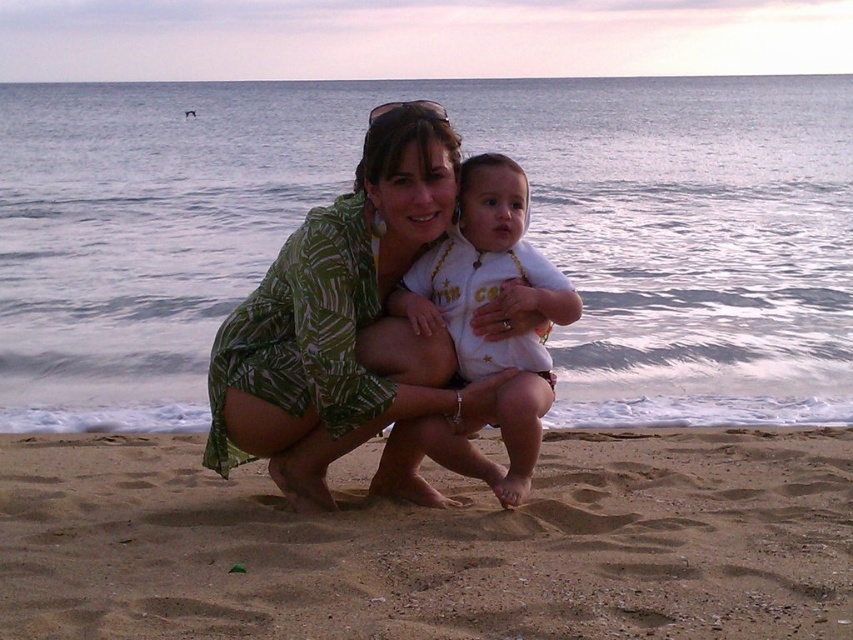
At what (x,y) coordinates should I click in order to perform the action: click on fine-grained sand at lower center. Please return your answer as a coordinate pair (x, y). The width and height of the screenshot is (853, 640). Looking at the image, I should click on (434, 545).

Which is behind, point (94, 563) or point (485, 342)?

The point (485, 342) is more distant.

Identify the location of fine-grained sand at lower center. The width and height of the screenshot is (853, 640). (434, 545).

Between green leaf-patterned dress at center and white cotton onesie at center, which one is positioned higher?

green leaf-patterned dress at center is above.

Who is more distant from viewer, [340,358] or [418,310]?

The point [418,310] is behind.

Is point (445, 195) behind point (462, 240)?

No, (445, 195) is in front of (462, 240).

You are a GUI agent. You are given a task and a screenshot of the screen. Output one action in this format:
    pyautogui.click(x=<x>, y=<y>)
    Task: Click on the green leaf-patterned dress at center
    
    Given the screenshot: What is the action you would take?
    pyautogui.click(x=344, y=326)

Which is more to the right, fine-grained sand at lower center or green leaf-patterned dress at center?

Positioned to the right is fine-grained sand at lower center.

Which of these two, fine-grained sand at lower center or green leaf-patterned dress at center, stands taller?

Standing taller between the two is green leaf-patterned dress at center.

What do you see at coordinates (434, 545) in the screenshot? I see `fine-grained sand at lower center` at bounding box center [434, 545].

At what (x,y) coordinates should I click in order to perform the action: click on fine-grained sand at lower center. Please return your answer as a coordinate pair (x, y). The image size is (853, 640). Looking at the image, I should click on (434, 545).